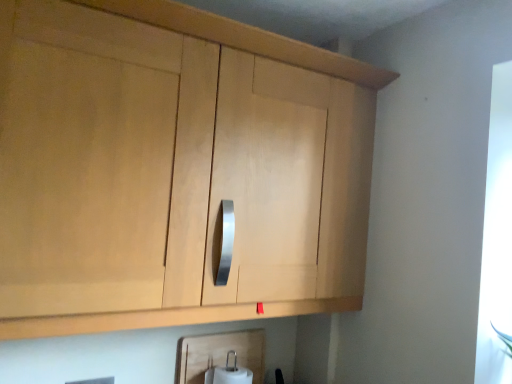
Question: Is white matte toilet paper at lower center at the left side of light wood cabinet at upper center?

Choices:
 (A) yes
 (B) no

Answer: (B)

Question: Is white matte toilet paper at lower center not close to light wood cabinet at upper center?

Choices:
 (A) yes
 (B) no

Answer: (B)

Question: From the image's perspective, is white matte toilet paper at lower center under light wood cabinet at upper center?

Choices:
 (A) yes
 (B) no

Answer: (A)

Question: Is white matte toilet paper at lower center thinner than light wood cabinet at upper center?

Choices:
 (A) no
 (B) yes

Answer: (B)

Question: Is white matte toilet paper at lower center surrounding light wood cabinet at upper center?

Choices:
 (A) no
 (B) yes

Answer: (A)

Question: Considering the relative positions of white matte toilet paper at lower center and light wood cabinet at upper center in the image provided, is white matte toilet paper at lower center to the right of light wood cabinet at upper center from the viewer's perspective?

Choices:
 (A) no
 (B) yes

Answer: (B)

Question: Considering the relative sizes of light wood cabinet at upper center and white matte toilet paper at lower center in the image provided, is light wood cabinet at upper center wider than white matte toilet paper at lower center?

Choices:
 (A) no
 (B) yes

Answer: (B)

Question: Considering the relative sizes of light wood cabinet at upper center and white matte toilet paper at lower center in the image provided, is light wood cabinet at upper center smaller than white matte toilet paper at lower center?

Choices:
 (A) yes
 (B) no

Answer: (B)

Question: From the image's perspective, is light wood cabinet at upper center located beneath white matte toilet paper at lower center?

Choices:
 (A) yes
 (B) no

Answer: (B)

Question: Is light wood cabinet at upper center in front of white matte toilet paper at lower center?

Choices:
 (A) no
 (B) yes

Answer: (B)

Question: Does light wood cabinet at upper center appear on the right side of white matte toilet paper at lower center?

Choices:
 (A) yes
 (B) no

Answer: (B)

Question: Can you confirm if light wood cabinet at upper center is bigger than white matte toilet paper at lower center?

Choices:
 (A) no
 (B) yes

Answer: (B)

Question: From a real-world perspective, is white matte toilet paper at lower center above or below light wood cabinet at upper center?

Choices:
 (A) above
 (B) below

Answer: (B)